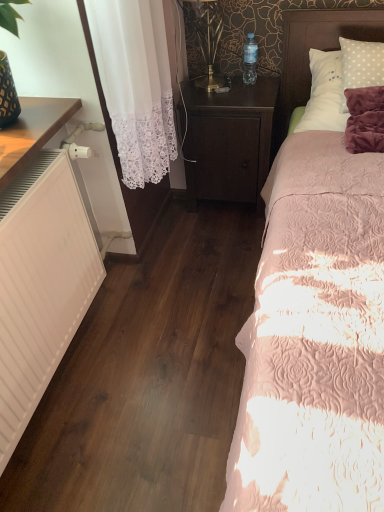
Describe the element at coordinates (206, 38) in the screenshot. This screenshot has width=384, height=512. I see `metallic gold table lamp at upper center` at that location.

At what (x,y) coordinates should I click in order to perform the action: click on white polka dot pillow at upper right. Please return your answer as a coordinate pair (x, y). This screenshot has height=512, width=384. Looking at the image, I should click on (315, 48).

The image size is (384, 512). I want to click on bed below the transparent plastic bottle at upper center (from a real-world perspective), so click(x=314, y=337).

From the picture: Is pink quilted bed at right not near transparent plastic bottle at upper center?

pink quilted bed at right is actually quite close to transparent plastic bottle at upper center.

From a real-world perspective, between pink quilted bed at right and transparent plastic bottle at upper center, who is vertically lower?

pink quilted bed at right is physically lower.

Measure the distance from pink quilted bed at right to transparent plastic bottle at upper center.

They are 34.33 inches apart.

From the picture: From the image's perspective, relative to white polka dot pillow at upper right, is metallic gold table lamp at upper center above or below?

metallic gold table lamp at upper center is above white polka dot pillow at upper right.

Does metallic gold table lamp at upper center come in front of white polka dot pillow at upper right?

That is False.

Which of these two, metallic gold table lamp at upper center or white polka dot pillow at upper right, is smaller?

With smaller size is metallic gold table lamp at upper center.

Is metallic gold table lamp at upper center wider or thinner than white polka dot pillow at upper right?

Considering their sizes, metallic gold table lamp at upper center looks slimmer than white polka dot pillow at upper right.

Is white matte heater at left facing towards metallic gold table lamp at upper center?

No, white matte heater at left is not oriented towards metallic gold table lamp at upper center.

Is metallic gold table lamp at upper center located within white matte heater at left?

Definitely not — metallic gold table lamp at upper center is not inside white matte heater at left.

Which of these two, white matte heater at left or metallic gold table lamp at upper center, stands taller?

white matte heater at left.

From the image's perspective, which is above, white matte heater at left or metallic gold table lamp at upper center?

metallic gold table lamp at upper center is shown above in the image.

Is metallic gold table lamp at upper center oriented towards transparent plastic bottle at upper center?

No, metallic gold table lamp at upper center is not aimed at transparent plastic bottle at upper center.

Between metallic gold table lamp at upper center and transparent plastic bottle at upper center, which one appears on the left side from the viewer's perspective?

From the viewer's perspective, metallic gold table lamp at upper center appears more on the left side.

Which of these two, metallic gold table lamp at upper center or transparent plastic bottle at upper center, is smaller?

Smaller between the two is transparent plastic bottle at upper center.

Would you say pink quilted bed at right is a long distance from dark wood nightstand at center?

No.

Considering the sizes of objects pink quilted bed at right and dark wood nightstand at center in the image provided, who is thinner, pink quilted bed at right or dark wood nightstand at center?

With smaller width is dark wood nightstand at center.

Which is behind, pink quilted bed at right or dark wood nightstand at center?

dark wood nightstand at center.

Is dark wood nightstand at center at the back of pink quilted bed at right?

No.

Looking at this image, how different are the orientations of transparent plastic bottle at upper center and white polka dot pillow at upper right in degrees?

0.691 degrees separate the facing orientations of transparent plastic bottle at upper center and white polka dot pillow at upper right.

From the picture: Which object is further away from the camera, transparent plastic bottle at upper center or white polka dot pillow at upper right?

transparent plastic bottle at upper center is further away from the camera.

Does transparent plastic bottle at upper center have a lesser width compared to white polka dot pillow at upper right?

Yes, transparent plastic bottle at upper center is thinner than white polka dot pillow at upper right.

Is white polka dot pillow at upper right inside transparent plastic bottle at upper center?

No, white polka dot pillow at upper right is located outside of transparent plastic bottle at upper center.

Locate an element on the screen. The width and height of the screenshot is (384, 512). bottle lying on the left of white polka dot pillow at upper right is located at coordinates (250, 60).

From the image's perspective, which is below, white polka dot pillow at upper right or transparent plastic bottle at upper center?

white polka dot pillow at upper right is shown below in the image.

Is point (358, 30) more distant than point (244, 67)?

No, (358, 30) is closer to viewer.

How far apart are white polka dot pillow at upper right and transparent plastic bottle at upper center?

26.33 centimeters.

Locate an element on the screen. The image size is (384, 512). bed below the transparent plastic bottle at upper center (from the image's perspective) is located at coordinates (314, 337).

Locate an element on the screen. The height and width of the screenshot is (512, 384). headboard that appears in front of the metallic gold table lamp at upper center is located at coordinates (315, 48).

Considering their positions, is white polka dot pillow at upper right positioned closer to metallic gold table lamp at upper center than pink quilted bed at right?

white polka dot pillow at upper right.

Estimate the real-world distances between objects in this image. Which object is closer to dark wood nightstand at center, white polka dot pillow at upper right or pink quilted bed at right?

Based on the image, white polka dot pillow at upper right appears to be nearer to dark wood nightstand at center.

Considering their positions, is white polka dot pillow at upper right positioned further to metallic gold table lamp at upper center than dark wood nightstand at center?

white polka dot pillow at upper right.

Estimate the real-world distances between objects in this image. Which object is closer to white matte heater at left, white polka dot pillow at upper right or dark wood nightstand at center?

Among the two, dark wood nightstand at center is located nearer to white matte heater at left.

Considering their positions, is transparent plastic bottle at upper center positioned closer to pink quilted bed at right than white polka dot pillow at upper right?

The object closer to pink quilted bed at right is white polka dot pillow at upper right.

Estimate the real-world distances between objects in this image. Which object is closer to white matte heater at left, transparent plastic bottle at upper center or dark wood nightstand at center?

dark wood nightstand at center lies closer to white matte heater at left than the other object.

Estimate the real-world distances between objects in this image. Which object is further from pink quilted bed at right, transparent plastic bottle at upper center or metallic gold table lamp at upper center?

The object further to pink quilted bed at right is transparent plastic bottle at upper center.

Estimate the real-world distances between objects in this image. Which object is further from metallic gold table lamp at upper center, transparent plastic bottle at upper center or dark wood nightstand at center?

dark wood nightstand at center.

This screenshot has height=512, width=384. Find the location of `heater between pink quilted bed at right and metallic gold table lamp at upper center along the z-axis`. heater between pink quilted bed at right and metallic gold table lamp at upper center along the z-axis is located at coordinates (40, 284).

I want to click on bottle between dark wood nightstand at center and white polka dot pillow at upper right, so click(250, 60).

The height and width of the screenshot is (512, 384). What are the coordinates of `headboard between pink quilted bed at right and transparent plastic bottle at upper center along the z-axis` in the screenshot? It's located at (315, 48).

Image resolution: width=384 pixels, height=512 pixels. Find the location of `bed located between white matte heater at left and white polka dot pillow at upper right in the left-right direction`. bed located between white matte heater at left and white polka dot pillow at upper right in the left-right direction is located at coordinates (314, 337).